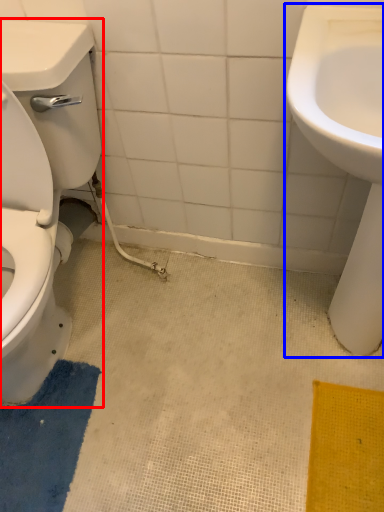
Question: Which point is closer to the camera, porcelain (highlighted by a red box) or sink (highlighted by a blue box)?

Choices:
 (A) porcelain
 (B) sink

Answer: (A)